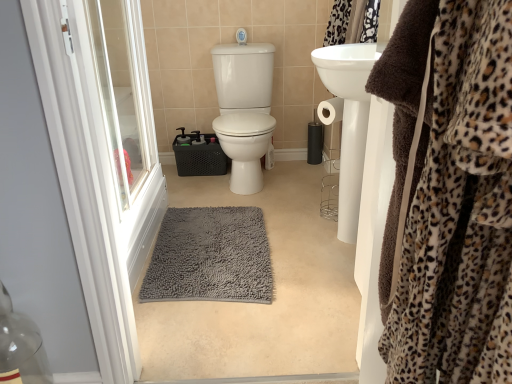
Question: In the image, is white plastic screen door at left positioned in front of or behind gray shaggy bath mat at center?

Choices:
 (A) behind
 (B) front

Answer: (B)

Question: From the image's perspective, relative to gray shaggy bath mat at center, is white plastic screen door at left above or below?

Choices:
 (A) above
 (B) below

Answer: (A)

Question: Based on their relative distances, which object is farther from the brown plush robe at right?

Choices:
 (A) gray shaggy bath mat at center
 (B) gray shaggy rug at center
 (C) white plastic screen door at left

Answer: (A)

Question: Which of these objects is positioned closest to the brown plush robe at right?

Choices:
 (A) gray shaggy bath mat at center
 (B) gray shaggy rug at center
 (C) white plastic screen door at left

Answer: (C)